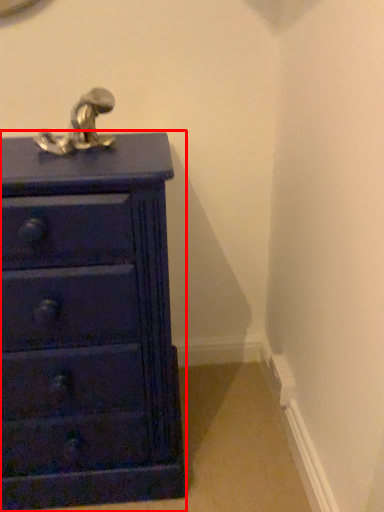
Question: From the image's perspective, where is chest of drawers (annotated by the red box) located relative to tap?

Choices:
 (A) below
 (B) above

Answer: (A)